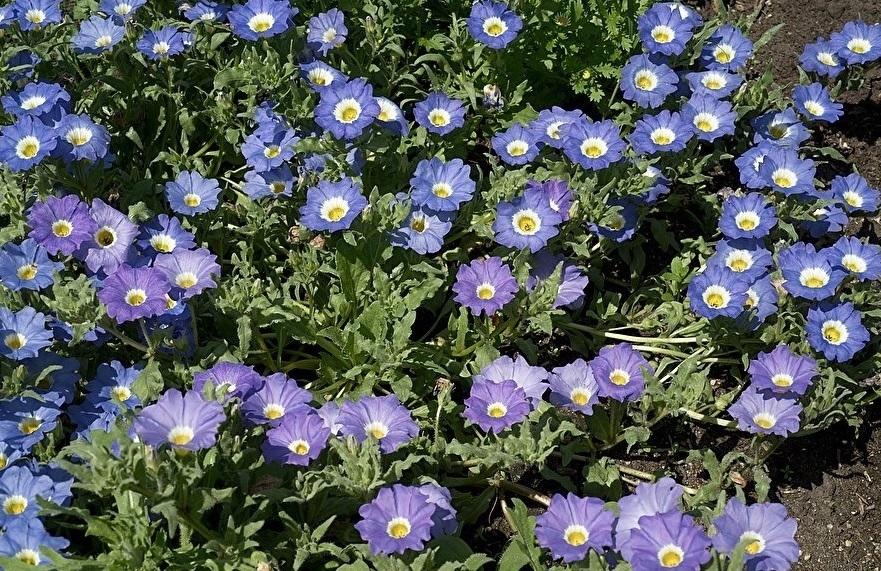
Identify the location of plant. The width and height of the screenshot is (881, 571). (679, 373).